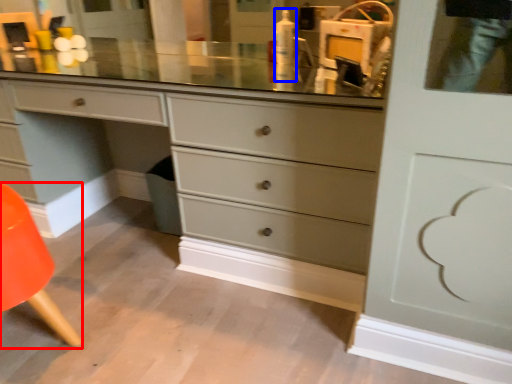
Question: Which of the following is the closest to the observer, armchair (highlighted by a red box) or toiletry (highlighted by a blue box)?

Choices:
 (A) armchair
 (B) toiletry

Answer: (A)